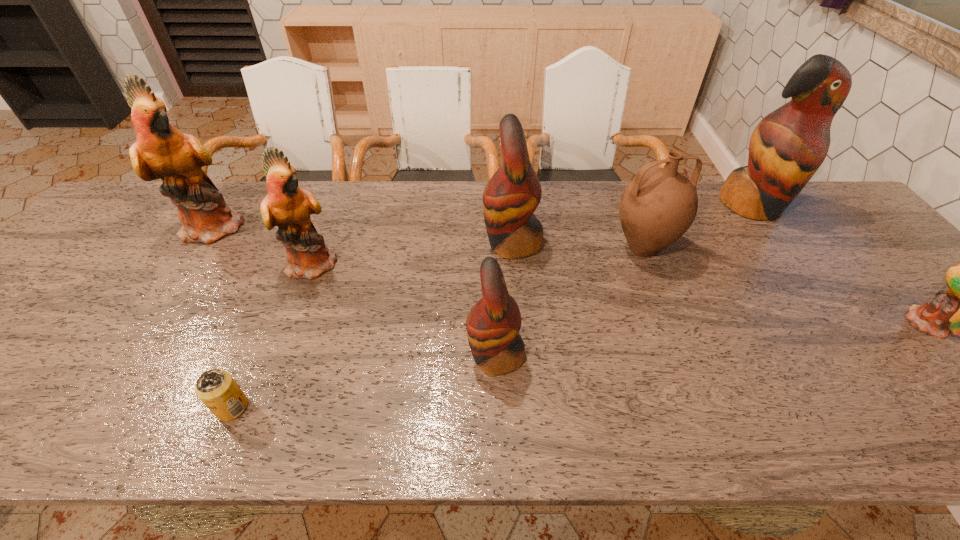
At what (x,y) coordinates should I click in order to perform the action: click on parrot that is the fifth closest one to the smallest red parrot. Please return your answer as a coordinate pair (x, y). The width and height of the screenshot is (960, 540). Looking at the image, I should click on pos(959,310).

Identify which green parrot is the second closest to the brown pitcher. Please provide its 2D coordinates. Your answer should be formatted as a tuple, i.e. [(x, y)], where the tuple contains the x and y coordinates of a point satisfying the conditions above.

[(287, 206)]

Identify which green parrot is the second nearest to the smallest red parrot. Please provide its 2D coordinates. Your answer should be formatted as a tuple, i.e. [(x, y)], where the tuple contains the x and y coordinates of a point satisfying the conditions above.

[(161, 151)]

Select which red parrot appears as the second closest to the pitcher. Please provide its 2D coordinates. Your answer should be formatted as a tuple, i.e. [(x, y)], where the tuple contains the x and y coordinates of a point satisfying the conditions above.

[(788, 146)]

Locate which red parrot ranks in proximity to the nearest red parrot. Please provide its 2D coordinates. Your answer should be formatted as a tuple, i.e. [(x, y)], where the tuple contains the x and y coordinates of a point satisfying the conditions above.

[(513, 193)]

Locate an element on the screen. vacant area in the image that satisfies the following two spatial constraints: 1. on the face of the second object from right to left; 2. on the face of the nearest red parrot is located at coordinates (857, 356).

Identify the location of blank area in the image that satisfies the following two spatial constraints: 1. on the face of the biggest red parrot; 2. on the front-facing side of the leftmost object. The width and height of the screenshot is (960, 540). (766, 226).